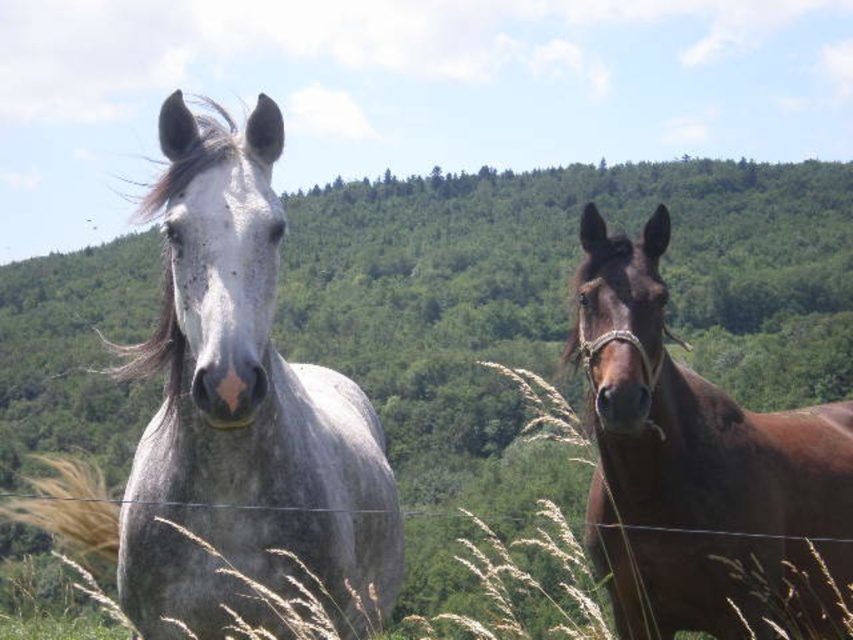
You are a farmer checking the health of your horses. You notice that the gray speckled horse at center and the brown glossy horse at right have different heights. Which horse should you adjust the height of the feed trough for to accommodate their size?

The gray speckled horse at center is much taller than the brown glossy horse at right, so you should adjust the feed trough height to accommodate the taller gray speckled horse at center.

You are standing at the center of the image and want to locate the gray speckled horse at center. According to the coordinates provided, in which direction should you look to find it?

The gray speckled horse at center is located at coordinates point [242,410]. Since the x coordinate is 0.642, which is greater than 0.5, it is to the right of the center. The y coordinate is 0.285, which is below 0.5, so it is lower than the center. Therefore, you should look to the right and downward from the center to locate it.